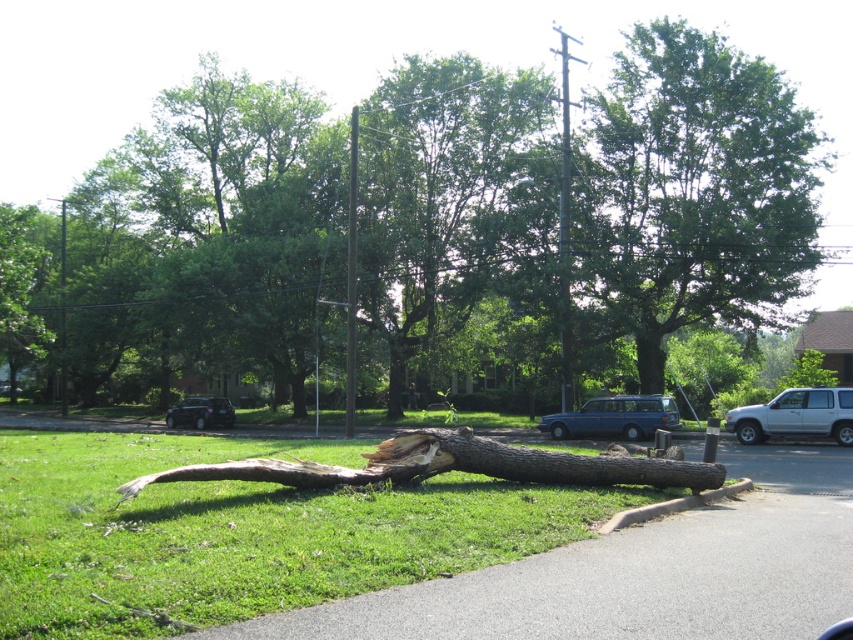
Question: Which object is positioned farthest from the white matte suv at lower right?

Choices:
 (A) matte black suv at center
 (B) green leafy tree at center
 (C) green grass at lower left
 (D) smooth concrete curb at lower right

Answer: (B)

Question: Is green leafy tree at center bigger than matte black suv at center?

Choices:
 (A) no
 (B) yes

Answer: (B)

Question: Can you confirm if white matte suv at lower right is positioned to the right of matte black suv at center?

Choices:
 (A) no
 (B) yes

Answer: (B)

Question: Among these objects, which one is nearest to the camera?

Choices:
 (A) green leafy tree at center
 (B) green grass at lower left
 (C) white matte suv at lower right
 (D) brown rough wood log at center

Answer: (B)

Question: Does brown rough wood log at center appear under blue metallic van at center?

Choices:
 (A) no
 (B) yes

Answer: (A)

Question: Which object is closer to the camera taking this photo?

Choices:
 (A) smooth concrete curb at lower right
 (B) green grass at lower left
 (C) matte black suv at center
 (D) green leafy tree at center

Answer: (B)